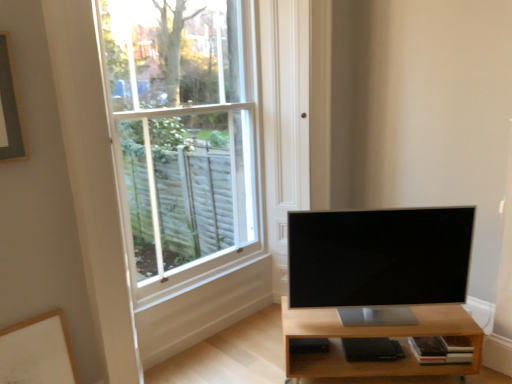
Question: Are light brown wood shelf at lower right and satin black tv at center making contact?

Choices:
 (A) no
 (B) yes

Answer: (A)

Question: Considering the relative sizes of light brown wood shelf at lower right and satin black tv at center in the image provided, is light brown wood shelf at lower right thinner than satin black tv at center?

Choices:
 (A) yes
 (B) no

Answer: (B)

Question: Does light brown wood shelf at lower right appear on the left side of satin black tv at center?

Choices:
 (A) no
 (B) yes

Answer: (A)

Question: Can you confirm if light brown wood shelf at lower right is shorter than satin black tv at center?

Choices:
 (A) no
 (B) yes

Answer: (B)

Question: From the image's perspective, would you say light brown wood shelf at lower right is positioned over satin black tv at center?

Choices:
 (A) yes
 (B) no

Answer: (B)

Question: Considering the relative sizes of light brown wood shelf at lower right and satin black tv at center in the image provided, is light brown wood shelf at lower right taller than satin black tv at center?

Choices:
 (A) yes
 (B) no

Answer: (B)

Question: Is white matte picture frame at lower left oriented towards satin black tv at center?

Choices:
 (A) yes
 (B) no

Answer: (B)

Question: Would you say white matte picture frame at lower left is a long distance from satin black tv at center?

Choices:
 (A) yes
 (B) no

Answer: (A)

Question: Can you confirm if white matte picture frame at lower left is wider than satin black tv at center?

Choices:
 (A) yes
 (B) no

Answer: (B)

Question: Does white matte picture frame at lower left appear on the left side of satin black tv at center?

Choices:
 (A) yes
 (B) no

Answer: (A)

Question: Considering the relative sizes of white matte picture frame at lower left and satin black tv at center in the image provided, is white matte picture frame at lower left bigger than satin black tv at center?

Choices:
 (A) no
 (B) yes

Answer: (A)

Question: Is white matte picture frame at lower left positioned behind satin black tv at center?

Choices:
 (A) yes
 (B) no

Answer: (B)

Question: Is light brown wood shelf at lower right outside white matte picture frame at lower left?

Choices:
 (A) no
 (B) yes

Answer: (B)